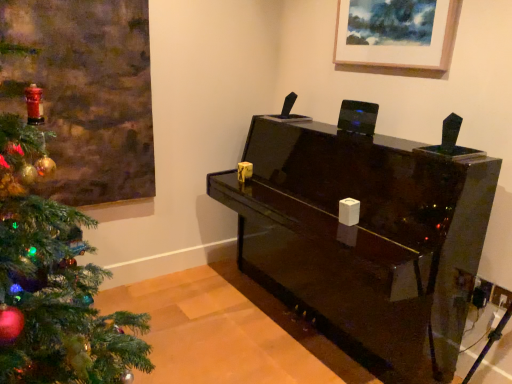
What is the approximate width of wooden picture frame at upper center?

wooden picture frame at upper center is 5.18 centimeters wide.

This screenshot has height=384, width=512. What do you see at coordinates (401, 43) in the screenshot?
I see `wooden picture frame at upper center` at bounding box center [401, 43].

The height and width of the screenshot is (384, 512). I want to click on wooden picture frame at upper center, so (401, 43).

This screenshot has width=512, height=384. What do you see at coordinates (365, 239) in the screenshot? I see `glossy black piano at center` at bounding box center [365, 239].

At what (x,y) coordinates should I click in order to perform the action: click on glossy black piano at center. Please return your answer as a coordinate pair (x, y). This screenshot has width=512, height=384. Looking at the image, I should click on (365, 239).

Locate an element on the screen. This screenshot has height=384, width=512. wooden picture frame at upper center is located at coordinates (401, 43).

Does wooden picture frame at upper center appear on the left side of glossy black piano at center?

In fact, wooden picture frame at upper center is to the right of glossy black piano at center.

Is wooden picture frame at upper center further to the viewer compared to glossy black piano at center?

That is True.

Does point (405, 10) come farther from viewer compared to point (367, 205)?

Yes, point (405, 10) is behind point (367, 205).

From the image's perspective, would you say wooden picture frame at upper center is positioned over glossy black piano at center?

Yes, from the image's perspective, wooden picture frame at upper center is above glossy black piano at center.

From a real-world perspective, between wooden picture frame at upper center and glossy black piano at center, who is vertically lower?

glossy black piano at center.

Does wooden picture frame at upper center have a greater width compared to glossy black piano at center?

No.

In terms of height, does wooden picture frame at upper center look taller or shorter compared to glossy black piano at center?

Considering their sizes, wooden picture frame at upper center has less height than glossy black piano at center.

Does wooden picture frame at upper center have a larger size compared to glossy black piano at center?

No, wooden picture frame at upper center is not bigger than glossy black piano at center.

Is glossy black piano at center completely or partially inside wooden picture frame at upper center?

No.

Is wooden picture frame at upper center in contact with glossy black piano at center?

wooden picture frame at upper center is not next to glossy black piano at center, and they're not touching.

Could you tell me if wooden picture frame at upper center is turned towards glossy black piano at center?

No, wooden picture frame at upper center is not oriented towards glossy black piano at center.

Looking at this image, can you tell me how much wooden picture frame at upper center and glossy black piano at center differ in facing direction?

They differ by 1.95 degrees in their facing directions.

Locate an element on the screen. This screenshot has height=384, width=512. picture frame located above the glossy black piano at center (from the image's perspective) is located at coordinates (401, 43).

Is glossy black piano at center to the left of wooden picture frame at upper center from the viewer's perspective?

Correct, you'll find glossy black piano at center to the left of wooden picture frame at upper center.

Is glossy black piano at center in front of or behind wooden picture frame at upper center in the image?

glossy black piano at center is in front of wooden picture frame at upper center.

Which point is more distant from viewer, [323,173] or [426,65]?

The point [323,173] is more distant.

From the image's perspective, which one is positioned lower, glossy black piano at center or wooden picture frame at upper center?

From the image's view, glossy black piano at center is below.

From a real-world perspective, relative to wooden picture frame at upper center, is glossy black piano at center vertically above or below?

Clearly, from a real-world perspective, glossy black piano at center is below wooden picture frame at upper center.

In the scene shown: Is glossy black piano at center thinner than wooden picture frame at upper center?

Incorrect, the width of glossy black piano at center is not less than that of wooden picture frame at upper center.

Who is taller, glossy black piano at center or wooden picture frame at upper center?

Standing taller between the two is glossy black piano at center.

Does glossy black piano at center have a smaller size compared to wooden picture frame at upper center?

No.

Is glossy black piano at center not inside wooden picture frame at upper center?

Yes, glossy black piano at center is not within wooden picture frame at upper center.

Is glossy black piano at center next to wooden picture frame at upper center and touching it?

No.

Is glossy black piano at center facing towards wooden picture frame at upper center?

No, glossy black piano at center is not oriented towards wooden picture frame at upper center.

The width and height of the screenshot is (512, 384). In the image, there is a glossy black piano at center. Identify the location of picture frame above it (from the image's perspective). (401, 43).

This screenshot has width=512, height=384. I want to click on picture frame behind the glossy black piano at center, so click(x=401, y=43).

Locate an element on the screen. Image resolution: width=512 pixels, height=384 pixels. picture frame above the glossy black piano at center (from a real-world perspective) is located at coordinates (401, 43).